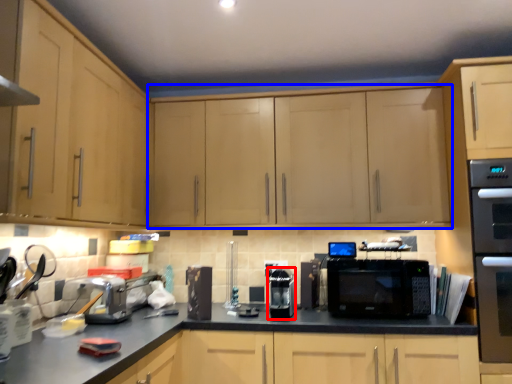
Question: Which point is further to the camera, appliance (highlighted by a red box) or cabinetry (highlighted by a blue box)?

Choices:
 (A) appliance
 (B) cabinetry

Answer: (B)